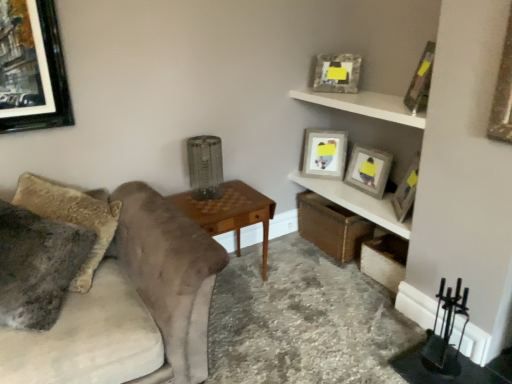
Question: In terms of width, does fuzzy fabric pillow at left look wider or thinner when compared to wooden shelf at upper right, positioned as the 1th shelf in bottom-to-top order?

Choices:
 (A) wide
 (B) thin

Answer: (A)

Question: From the image's perspective, relative to wooden shelf at upper right, positioned as the 1th shelf in bottom-to-top order, is fuzzy fabric pillow at left above or below?

Choices:
 (A) below
 (B) above

Answer: (A)

Question: Which object is the closest to the wooden picture frame at upper right, which appears as the second picture frame when viewed from the front?

Choices:
 (A) wooden shelf at upper right, positioned as the 1th shelf in bottom-to-top order
 (B) velvet gray couch at left
 (C) woodenobject at center
 (D) matte gray picture frame at upper right, the first picture frame in the back-to-front sequence
 (E) wooden textured picture frame at upper right, which appears as the fourth picture frame when viewed from the front

Answer: (A)

Question: Which of these objects is positioned farthest from the matte gray picture frame at upper right, positioned as the 5th picture frame in front-to-back order?

Choices:
 (A) wooden textured picture frame at upper right, which appears as the fourth picture frame when viewed from the front
 (B) white matte shelf at upper right, which is the first shelf from top to bottom
 (C) wooden shelf at upper right, positioned as the 1th shelf in bottom-to-top order
 (D) wooden picture frame at upper right, positioned as the 1th picture frame in front-to-back order
 (E) matte gray picture frame at upper right, acting as the 3th picture frame starting from the front

Answer: (D)